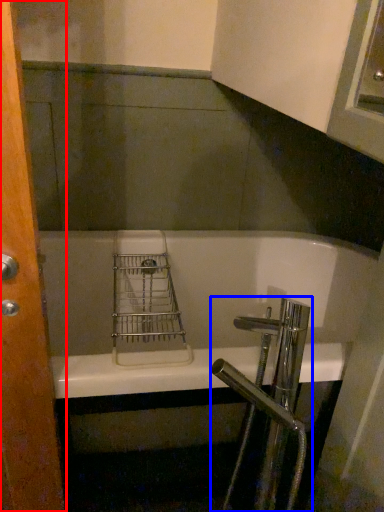
Question: Which object appears farthest to the camera in this image, screen door (highlighted by a red box) or tap (highlighted by a blue box)?

Choices:
 (A) screen door
 (B) tap

Answer: (B)